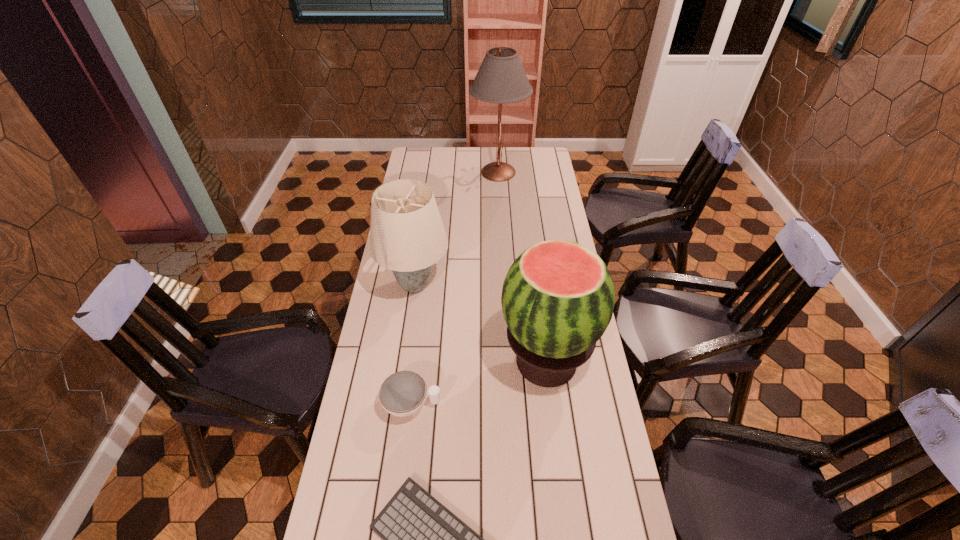
Identify the location of free space at the far left corner of the desktop. The height and width of the screenshot is (540, 960). (428, 148).

Where is `vacant point at the far right corner`? The image size is (960, 540). vacant point at the far right corner is located at coordinates (528, 166).

I want to click on free space between the farthest object and the second farthest object, so click(457, 228).

This screenshot has width=960, height=540. I want to click on free space between the farthest object and the chinaware, so click(455, 288).

At what (x,y) coordinates should I click in order to perform the action: click on vacant area that lies between the watermelon and the fourth nearest object. Please return your answer as a coordinate pair (x, y). This screenshot has width=960, height=540. Looking at the image, I should click on click(481, 323).

Find the location of a particular element. The width and height of the screenshot is (960, 540). free spot between the fourth nearest object and the table lamp is located at coordinates (457, 228).

Identify which object is the nearest to the watermelon. Please provide its 2D coordinates. Your answer should be formatted as a tuple, i.e. [(x, y)], where the tuple contains the x and y coordinates of a point satisfying the conditions above.

[(403, 393)]

Where is `object that can be found as the third closest to the second shortest object`? The image size is (960, 540). object that can be found as the third closest to the second shortest object is located at coordinates (407, 235).

Where is `free space that satisfies the following two spatial constraints: 1. on the front-facing side of the watermelon; 2. on the right side of the tallest object`? Image resolution: width=960 pixels, height=540 pixels. free space that satisfies the following two spatial constraints: 1. on the front-facing side of the watermelon; 2. on the right side of the tallest object is located at coordinates (509, 361).